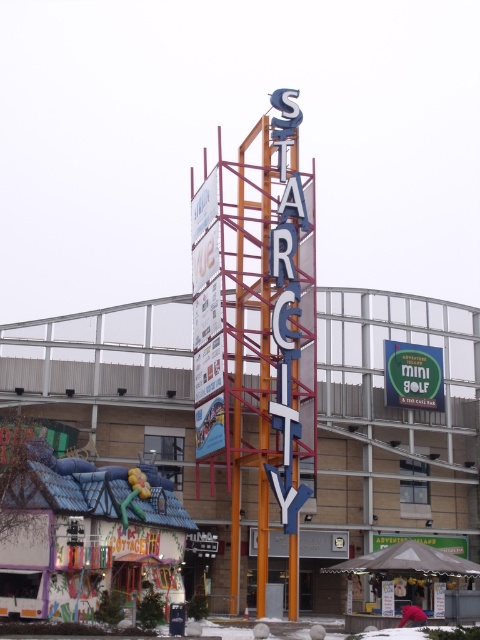
Is point (111, 422) less distant than point (396, 362)?

That is True.

Can you confirm if metallic blue sign at center is positioned to the left of green matte mini golf sign at center?

Indeed, metallic blue sign at center is positioned on the left side of green matte mini golf sign at center.

Who is more distant from viewer, [95,458] or [410,397]?

Point [410,397]

Where is `metallic blue sign at center`? This screenshot has width=480, height=640. metallic blue sign at center is located at coordinates (392, 428).